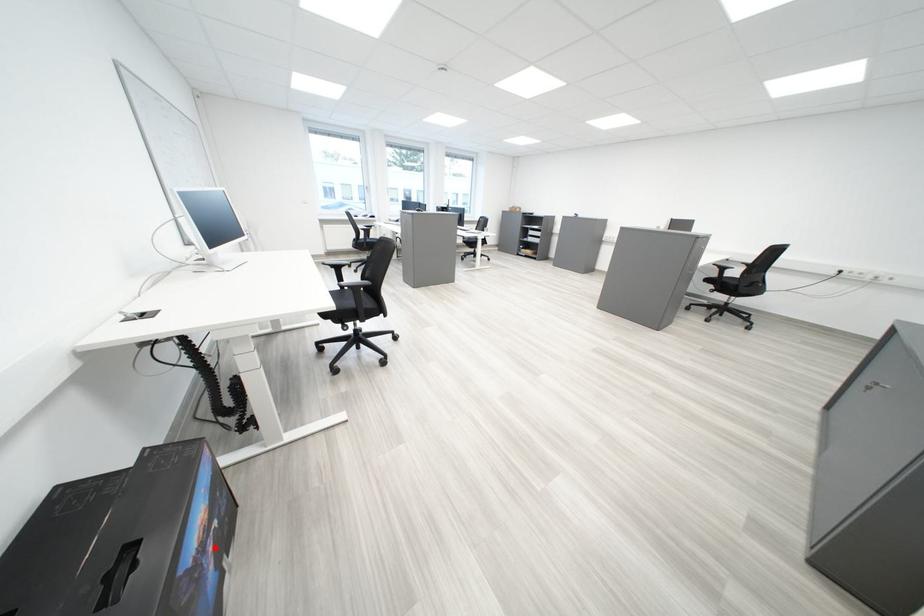
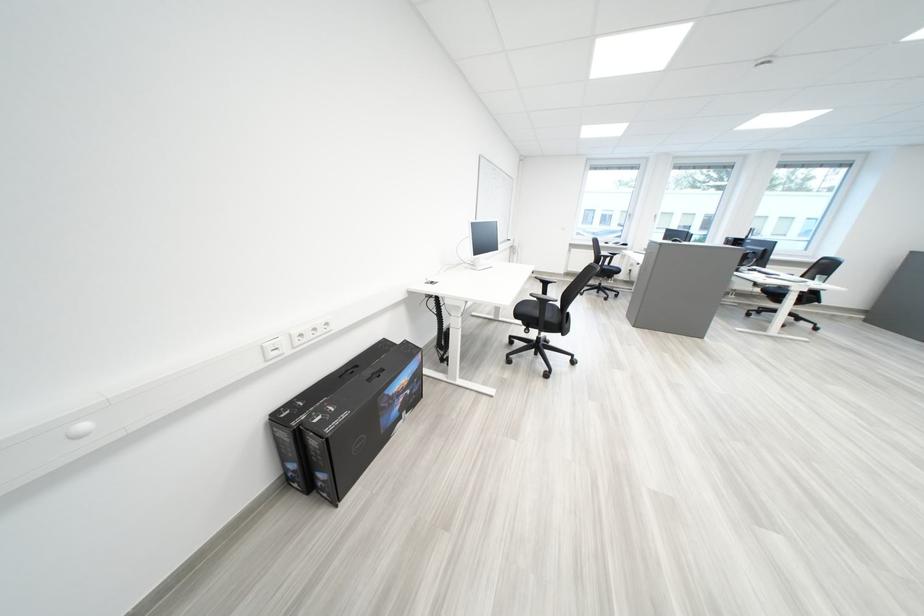
Question: A red point is marked in image1. In image2, is the corresponding 3D point closer to the camera or farther? Reply with the corresponding letter.

Choices:
 (A) The corresponding 3D point is closer.
 (B) The corresponding 3D point is farther.

Answer: (A)